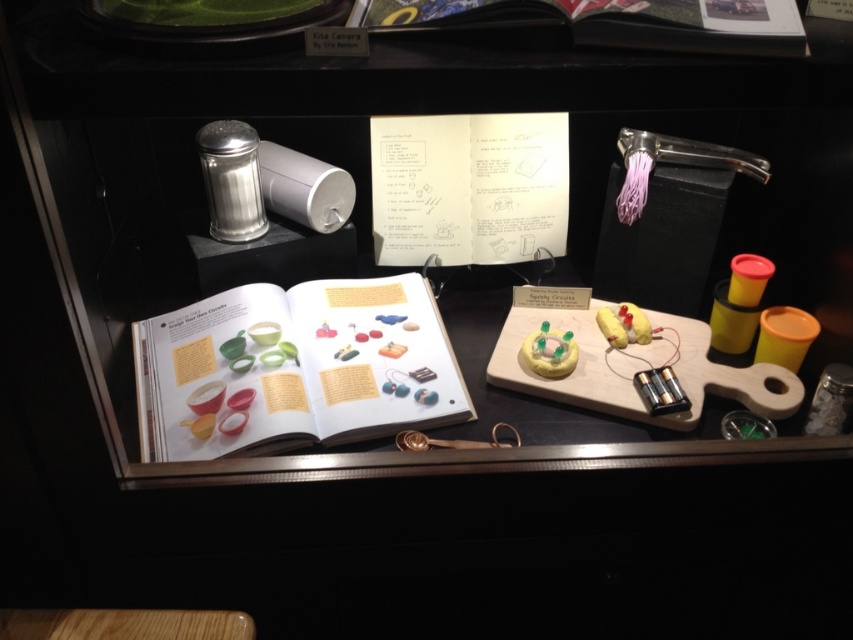
Can you confirm if matte paper book at center is thinner than white paper book at upper center?

Incorrect, matte paper book at center's width is not less than white paper book at upper center's.

Who is higher up, matte paper book at center or white paper book at upper center?

white paper book at upper center is above.

Between point (410, 422) and point (672, 1), which one is positioned behind?

Point (410, 422)

Locate an element on the screen. matte paper book at center is located at coordinates (294, 368).

Does matte paper book at center have a greater width compared to brushed metal shaker at upper left?

Yes, matte paper book at center is wider than brushed metal shaker at upper left.

Is matte paper book at center further to the viewer compared to brushed metal shaker at upper left?

No, it is not.

Is point (271, 428) positioned in front of point (241, 124)?

Yes.

The image size is (853, 640). What are the coordinates of `matte paper book at center` in the screenshot? It's located at (294, 368).

Is white paper book at upper center thinner than brushed metal shaker at upper left?

Incorrect, white paper book at upper center's width is not less than brushed metal shaker at upper left's.

Which is below, white paper book at upper center or brushed metal shaker at upper left?

brushed metal shaker at upper left

In order to click on white paper book at upper center in this screenshot , I will do 610,20.